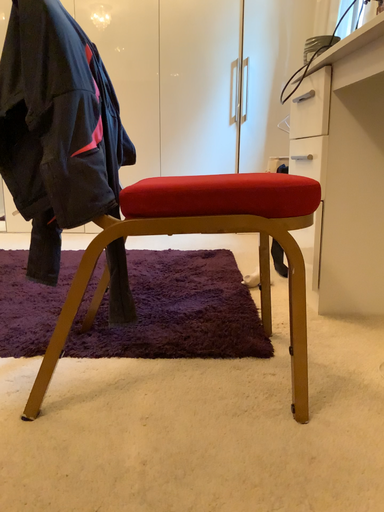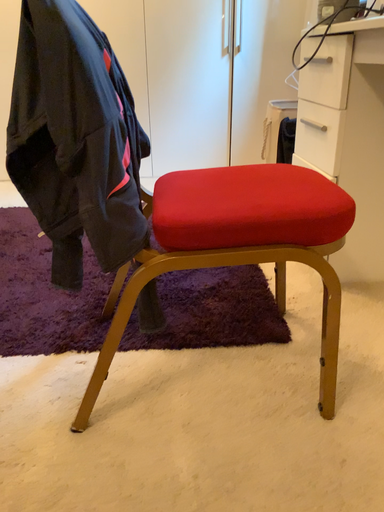
Question: How did the camera likely rotate when shooting the video?

Choices:
 (A) rotated downward
 (B) rotated upward

Answer: (A)